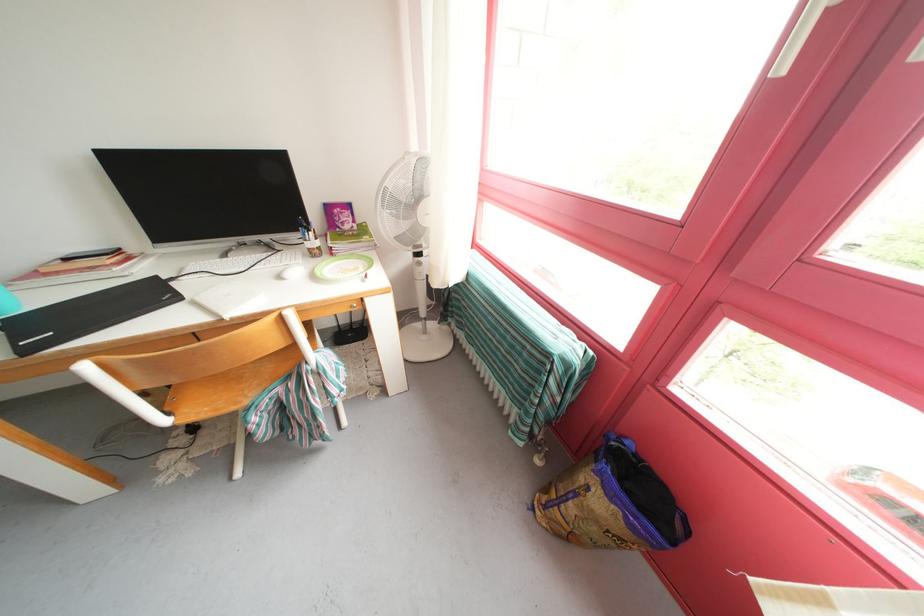
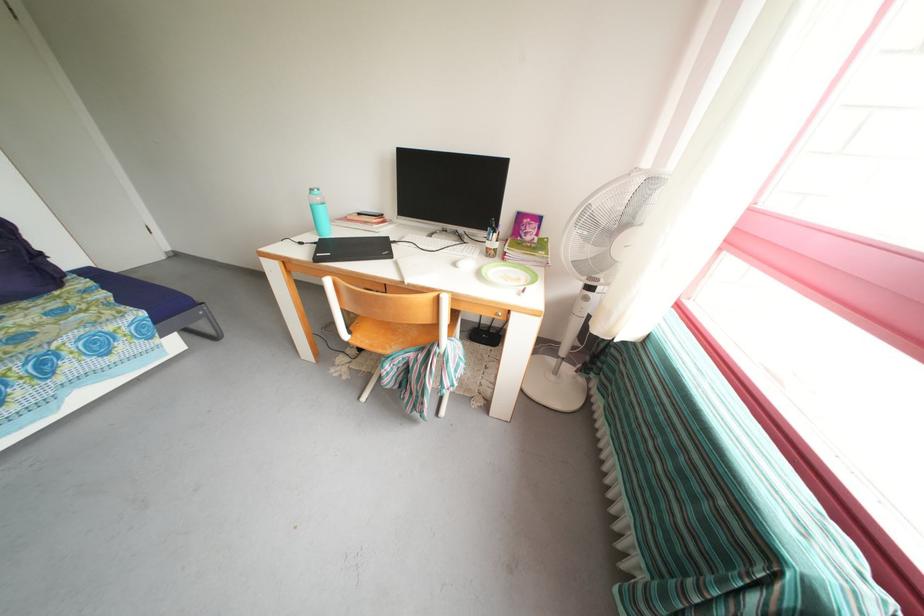
In the second image, find the point that corresponds to the point at 286,282 in the first image.

(462, 269)